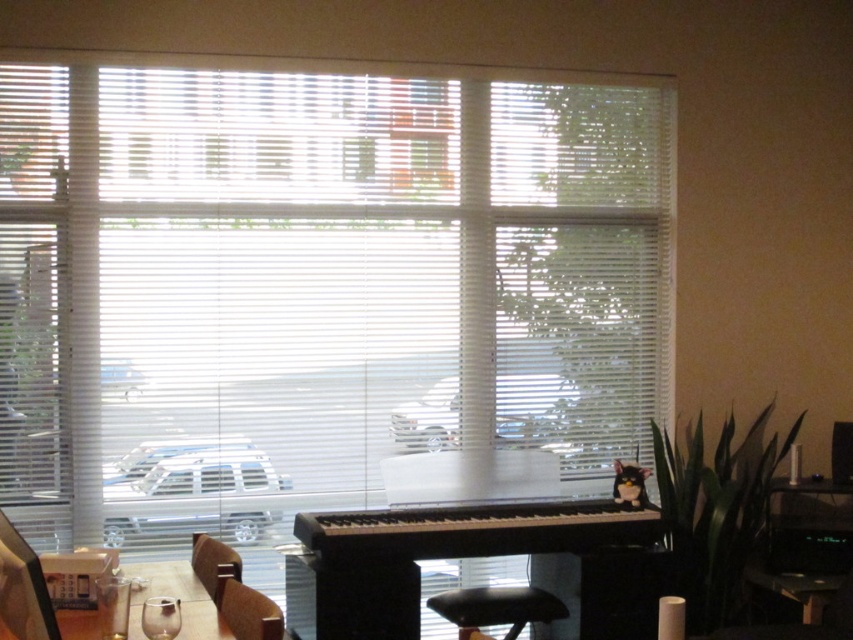
Question: Which object appears farthest from the camera in this image?

Choices:
 (A) clear glass table at lower left
 (B) wooden armchair at center

Answer: (B)

Question: Can you confirm if black leather bar stool at lower center is thinner than wooden armchair at center?

Choices:
 (A) yes
 (B) no

Answer: (B)

Question: Which of the following is the farthest from the observer?

Choices:
 (A) clear glass table at lower left
 (B) brown leather chair at lower left

Answer: (A)

Question: Which point is farther to the camera?

Choices:
 (A) (618, 236)
 (B) (300, 529)
 (C) (227, 589)
 (D) (489, 604)

Answer: (A)

Question: Does white blinds at center have a larger size compared to brown leather chair at lower left?

Choices:
 (A) yes
 (B) no

Answer: (A)

Question: Can you confirm if brown leather chair at lower left is thinner than clear glass wine glass at lower left?

Choices:
 (A) yes
 (B) no

Answer: (B)